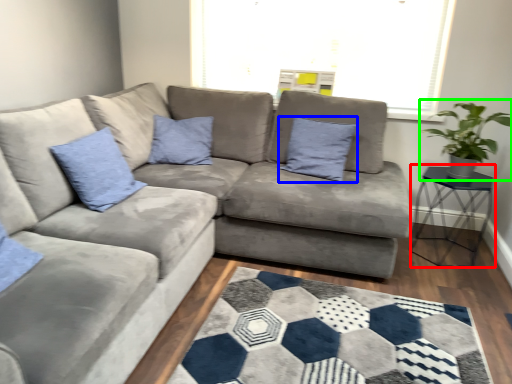
Question: Which object is the closest to the table (highlighted by a red box)? Choose among these: pillow (highlighted by a blue box) or houseplant (highlighted by a green box).

Choices:
 (A) pillow
 (B) houseplant

Answer: (B)